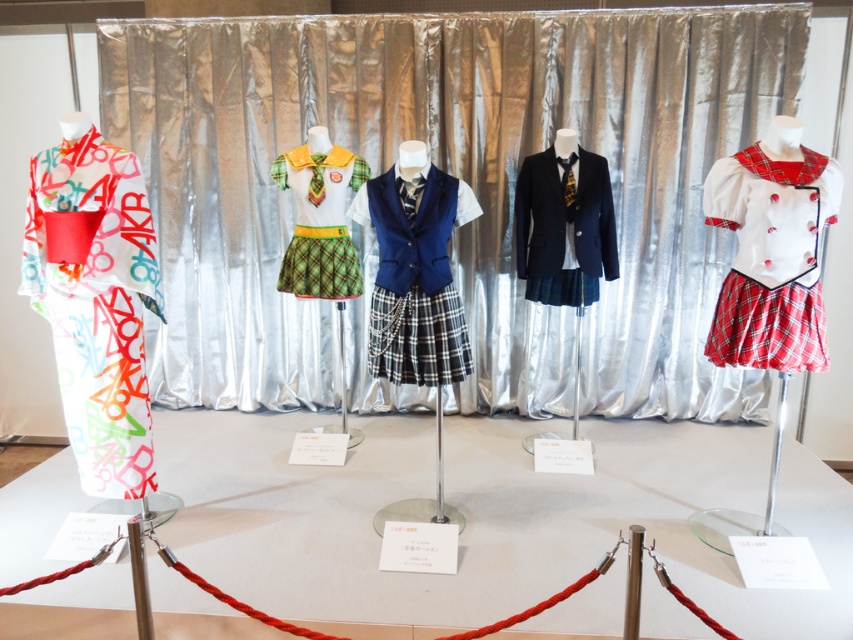
Is white plaid skirt at center to the left of navy blue fabric vest at center from the viewer's perspective?

No, white plaid skirt at center is not to the left of navy blue fabric vest at center.

Can you confirm if white plaid skirt at center is taller than navy blue fabric vest at center?

No.

Identify the location of white plaid skirt at center. (770, 259).

Consider the image. Does white glossy table at center have a greater height compared to green plaid skirt at center?

No.

Between white glossy table at center and green plaid skirt at center, which one has less height?

Standing shorter between the two is white glossy table at center.

Which is behind, point (492, 499) or point (285, 161)?

Positioned behind is point (285, 161).

Where is `white glossy table at center`? This screenshot has width=853, height=640. white glossy table at center is located at coordinates [x=489, y=516].

Does white glossy table at center appear on the right side of navy blue fabric vest at center?

Indeed, white glossy table at center is positioned on the right side of navy blue fabric vest at center.

Between point (589, 493) and point (373, 349), which one is positioned behind?

The point (589, 493) is behind.

Find the location of a particular element. white glossy table at center is located at coordinates (489, 516).